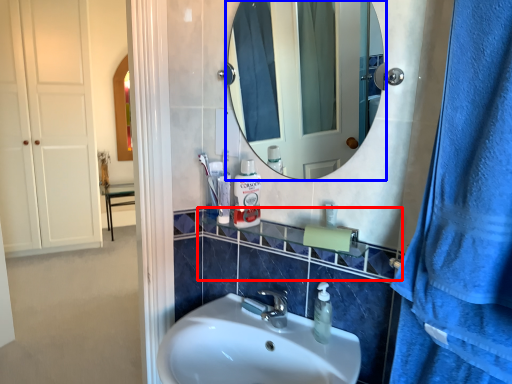
Question: Which object is further to the camera taking this photo, balustrade (highlighted by a red box) or mirror (highlighted by a blue box)?

Choices:
 (A) balustrade
 (B) mirror

Answer: (A)